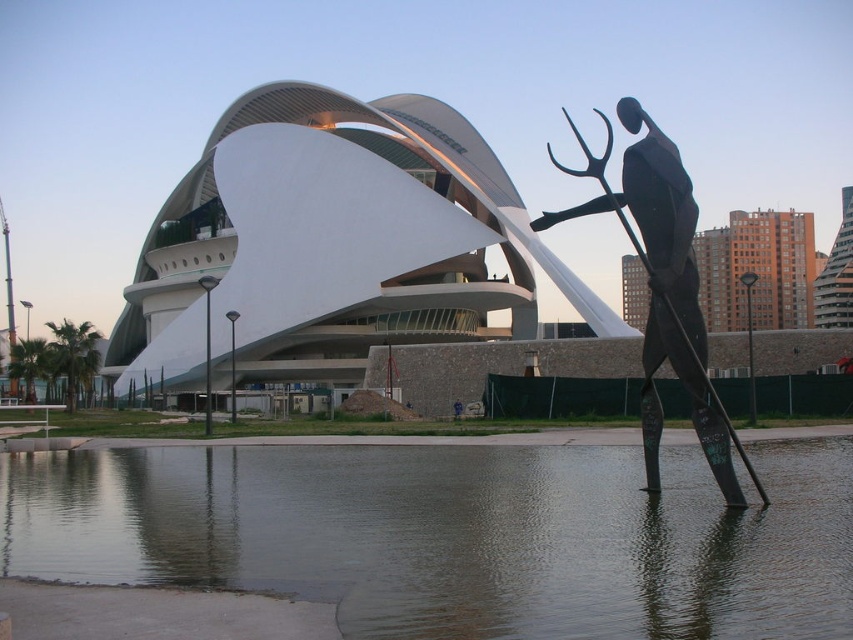
Question: Where is clear water at lower center located in relation to black metal trident at right in the image?

Choices:
 (A) right
 (B) left

Answer: (B)

Question: Does clear water at lower center have a smaller size compared to black metal trident at right?

Choices:
 (A) yes
 (B) no

Answer: (A)

Question: Among these objects, which one is farthest from the camera?

Choices:
 (A) black metal trident at right
 (B) clear water at lower center

Answer: (A)

Question: Does clear water at lower center appear over black metal trident at right?

Choices:
 (A) no
 (B) yes

Answer: (A)